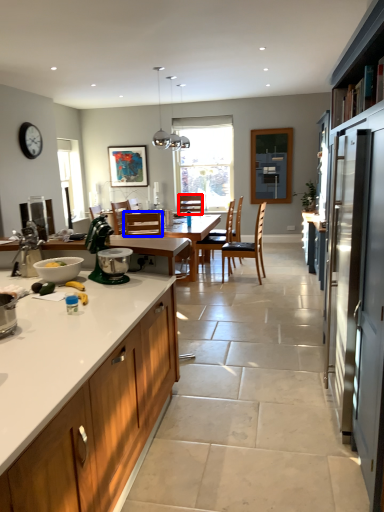
Question: Which of the following is the closest to the observer, chair (highlighted by a red box) or chair (highlighted by a blue box)?

Choices:
 (A) chair
 (B) chair

Answer: (B)